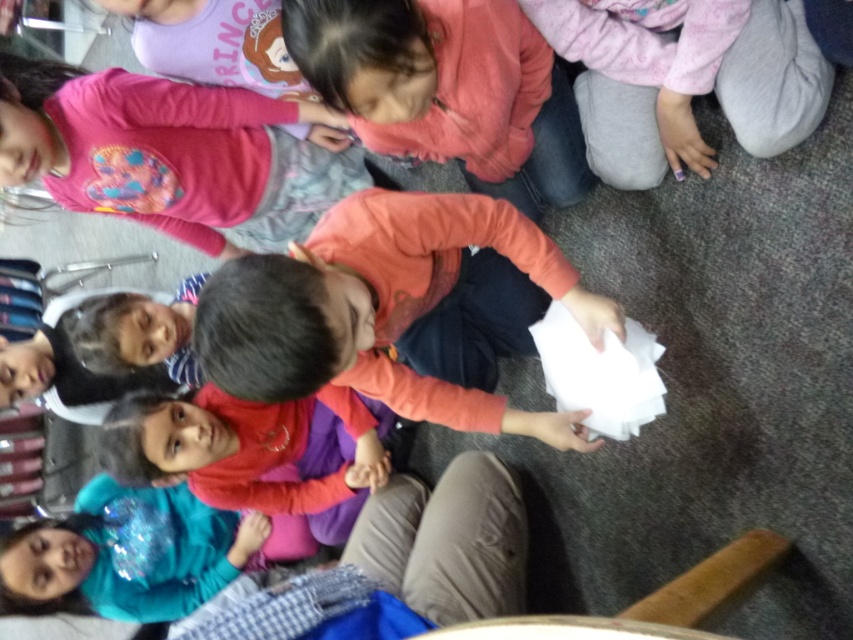
Can you confirm if pink fleece shirt at upper left is positioned to the left of teal glitter shirt at lower left?

No, pink fleece shirt at upper left is not to the left of teal glitter shirt at lower left.

Which is in front, point (61, 182) or point (181, 554)?

Positioned in front is point (61, 182).

You are a GUI agent. You are given a task and a screenshot of the screen. Output one action in this format:
    pyautogui.click(x=<x>, y=<y>)
    Task: Click on the pink fleece shirt at upper left
    
    Given the screenshot: What is the action you would take?
    pyautogui.click(x=171, y=154)

Can you confirm if matte pink shirt at center is thinner than teal glitter shirt at lower left?

Answer: Incorrect, matte pink shirt at center's width is not less than teal glitter shirt at lower left's.

Is matte pink shirt at center above teal glitter shirt at lower left?

Correct, matte pink shirt at center is located above teal glitter shirt at lower left.

What are the coordinates of `matte pink shirt at center` in the screenshot? It's located at (247, 460).

Based on the photo, who is positioned more to the left, matte pink sweater at center or teal glitter shirt at lower left?

Positioned to the left is teal glitter shirt at lower left.

Can you confirm if matte pink sweater at center is smaller than teal glitter shirt at lower left?

No, matte pink sweater at center is not smaller than teal glitter shirt at lower left.

Image resolution: width=853 pixels, height=640 pixels. Describe the element at coordinates (448, 90) in the screenshot. I see `matte pink sweater at center` at that location.

What are the coordinates of `matte pink sweater at center` in the screenshot? It's located at (448, 90).